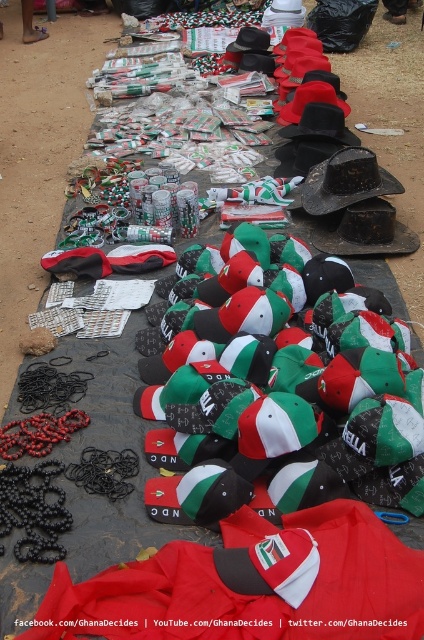
Question: Can you confirm if red polyester blanket at lower center is positioned to the right of matte black cowboy hat at center?

Choices:
 (A) yes
 (B) no

Answer: (B)

Question: Is red polyester blanket at lower center smaller than matte black cowboy hat at center?

Choices:
 (A) yes
 (B) no

Answer: (A)

Question: Considering the relative positions of red polyester blanket at lower center and matte black cowboy hat at center in the image provided, where is red polyester blanket at lower center located with respect to matte black cowboy hat at center?

Choices:
 (A) left
 (B) right

Answer: (A)

Question: Which of the following is the closest to the observer?

Choices:
 (A) red polyester blanket at lower center
 (B) matte black cowboy hat at center

Answer: (A)